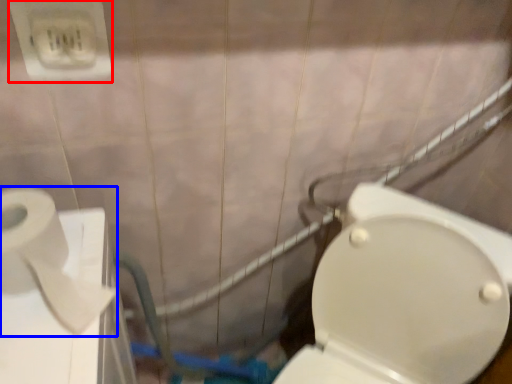
Question: Which object appears farthest to the camera in this image, electric outlet (highlighted by a red box) or toilet paper (highlighted by a blue box)?

Choices:
 (A) electric outlet
 (B) toilet paper

Answer: (A)